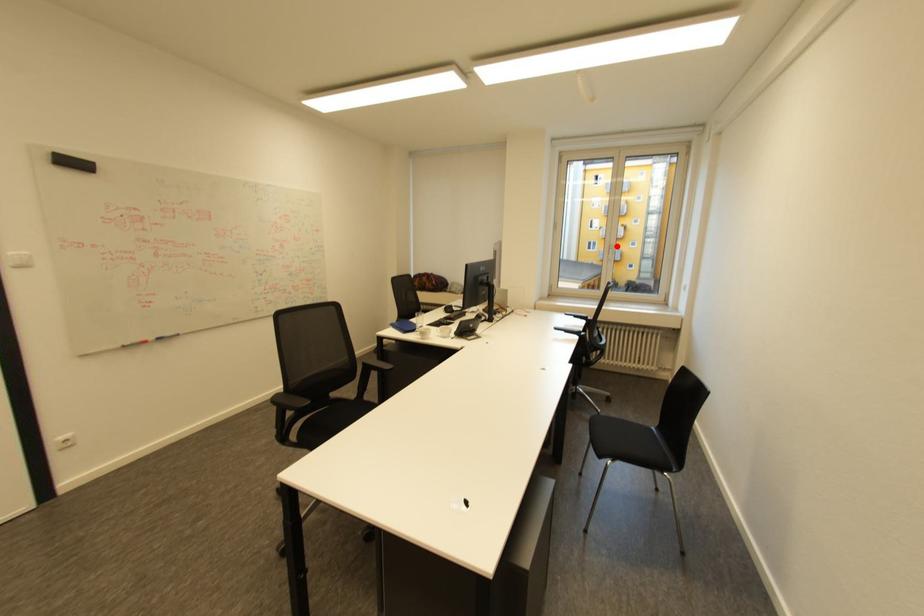
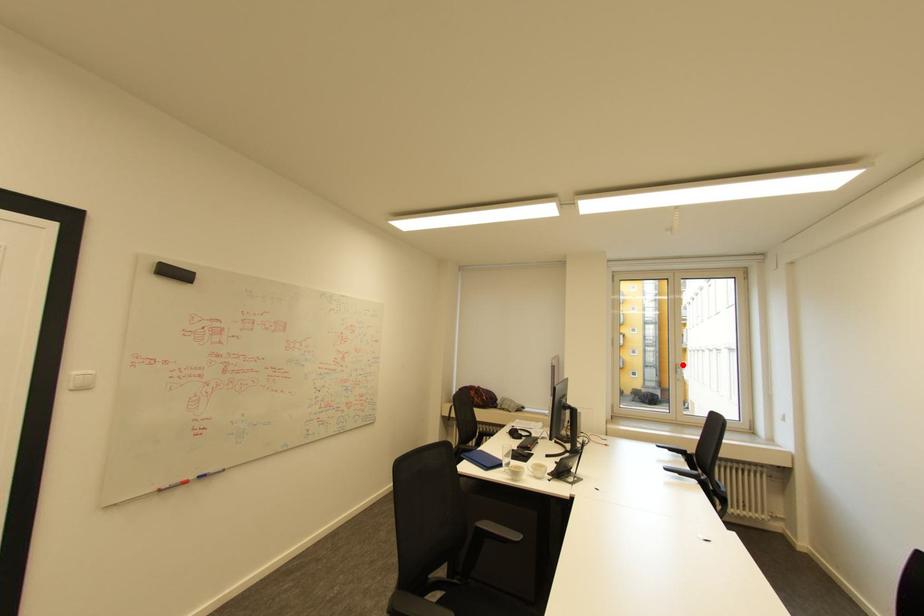
Based on the photo, I am providing you with two images of the same scene from different viewpoints. A red point is marked on the first image and another point is marked on the second image. Is the marked point in image1 the same physical position as the marked point in image2?

Yes